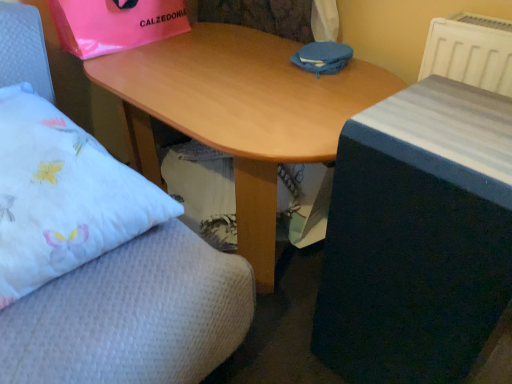
Question: Is white plastic radiator at upper right at the left side of wooden table at center?

Choices:
 (A) no
 (B) yes

Answer: (A)

Question: From a real-world perspective, is white plastic radiator at upper right beneath wooden table at center?

Choices:
 (A) no
 (B) yes

Answer: (A)

Question: Is white plastic radiator at upper right further to the viewer compared to wooden table at center?

Choices:
 (A) no
 (B) yes

Answer: (B)

Question: Does white plastic radiator at upper right have a lesser height compared to wooden table at center?

Choices:
 (A) no
 (B) yes

Answer: (B)

Question: Can you confirm if white plastic radiator at upper right is positioned to the right of wooden table at center?

Choices:
 (A) no
 (B) yes

Answer: (B)

Question: From the image's perspective, is white plastic radiator at upper right positioned above or below wooden desk at center?

Choices:
 (A) below
 (B) above

Answer: (B)

Question: Relative to wooden desk at center, is white plastic radiator at upper right in front or behind?

Choices:
 (A) behind
 (B) front

Answer: (A)

Question: Considering the positions of point (502, 62) and point (208, 129), is point (502, 62) closer or farther from the camera than point (208, 129)?

Choices:
 (A) farther
 (B) closer

Answer: (A)

Question: From a real-world perspective, is white plastic radiator at upper right physically located above or below wooden desk at center?

Choices:
 (A) above
 (B) below

Answer: (A)

Question: Which is correct: wooden table at center is inside pink plastic bag at upper left, or outside of it?

Choices:
 (A) outside
 (B) inside

Answer: (A)

Question: From their relative heights in the image, would you say wooden table at center is taller or shorter than pink plastic bag at upper left?

Choices:
 (A) tall
 (B) short

Answer: (A)

Question: From a real-world perspective, relative to pink plastic bag at upper left, is wooden table at center vertically above or below?

Choices:
 (A) above
 (B) below

Answer: (B)

Question: In the image, is wooden table at center on the left side or the right side of pink plastic bag at upper left?

Choices:
 (A) right
 (B) left

Answer: (A)

Question: Considering the relative positions of wooden table at center and white plastic radiator at upper right in the image provided, is wooden table at center to the left or to the right of white plastic radiator at upper right?

Choices:
 (A) left
 (B) right

Answer: (A)

Question: Looking at their shapes, would you say wooden table at center is wider or thinner than white plastic radiator at upper right?

Choices:
 (A) thin
 (B) wide

Answer: (B)